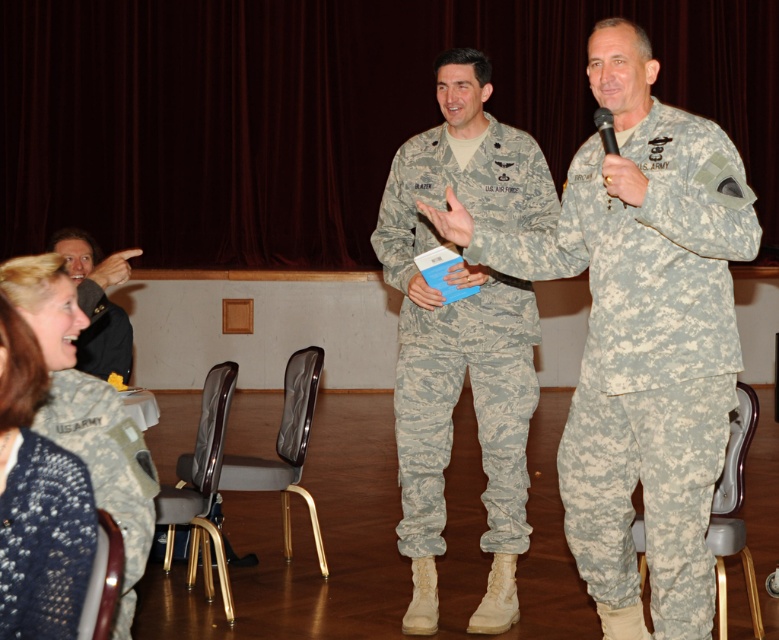
You are a photographer at the event and need to capture a photo that includes both the camouflage fabric uniform at right and the camouflage fabric uniform at lower left. Which one is positioned more to the right side of the image?

The camouflage fabric uniform at right is positioned more to the right side of the image compared to the camouflage fabric uniform at lower left.

Based on the photo, you are organizing a charity event and need to decide which item to place in a small donation box. The knitted blue sweater at lower left and the dark gray uniform at upper left are available. Based on their sizes, which one would fit better in the small donation box?

The knitted blue sweater at lower left has a smaller size compared to the dark gray uniform at upper left, so it would fit better in the small donation box.